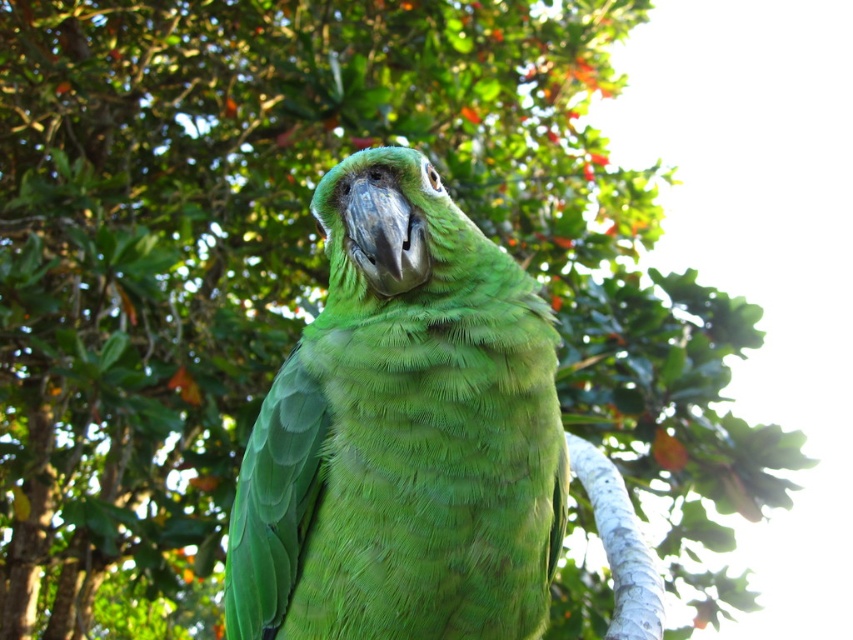
From the picture: You are a photographer aiming to capture the green feathered parrot at center and the white smooth tree branch at center in a single shot. Which object should you focus on first if you want to ensure both are in sharp focus?

The green feathered parrot at center is bigger than the white smooth tree branch at center, so you should focus on the green feathered parrot at center first to ensure both are in sharp focus.

You are an ornithologist observing the green feathered parrot at center and the white smooth tree branch at center from below. Which object appears taller when viewed from this angle?

The green feathered parrot at center appears taller than the white smooth tree branch at center when viewed from below because the green feathered parrot at center has a greater height compared to the white smooth tree branch at center.

You are standing below the green feathered parrot at center. If you look straight up, will you see the parrot directly above you?

The green feathered parrot at center is located at point (403, 433), so if you are standing directly below it, looking straight up would mean the parrot is not directly above you since the coordinates suggest it is offset to the right.